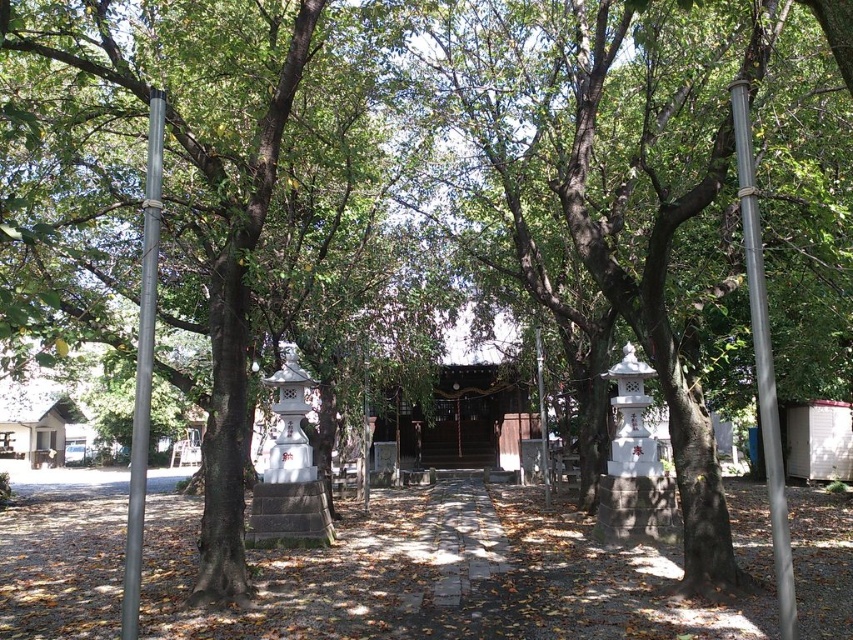
Question: Which object is positioned farthest from the metallic pole at left?

Choices:
 (A) white stone lantern at center
 (B) metallic pole at right

Answer: (A)

Question: Which object appears farthest from the camera in this image?

Choices:
 (A) metallic pole at right
 (B) white stone lantern at center

Answer: (B)

Question: Is metallic pole at left bigger than white stone lantern at center?

Choices:
 (A) yes
 (B) no

Answer: (A)

Question: Does metallic pole at left come in front of white stone lantern at center?

Choices:
 (A) no
 (B) yes

Answer: (B)

Question: Can you confirm if metallic pole at right is positioned below metallic pole at left?

Choices:
 (A) yes
 (B) no

Answer: (A)

Question: Which point appears farthest from the camera in this image?

Choices:
 (A) pos(543,467)
 (B) pos(154,161)
 (C) pos(743,243)

Answer: (A)